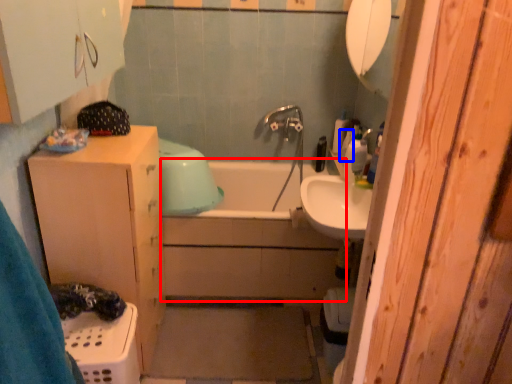
Question: Which of the following is the farthest to the observer, bath (highlighted by a red box) or toiletry (highlighted by a blue box)?

Choices:
 (A) bath
 (B) toiletry

Answer: (B)